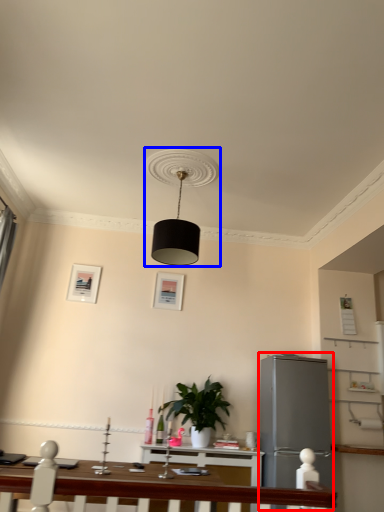
Question: Which of the following is the farthest to the observer, appliance (highlighted by a red box) or lamp (highlighted by a blue box)?

Choices:
 (A) appliance
 (B) lamp

Answer: (A)